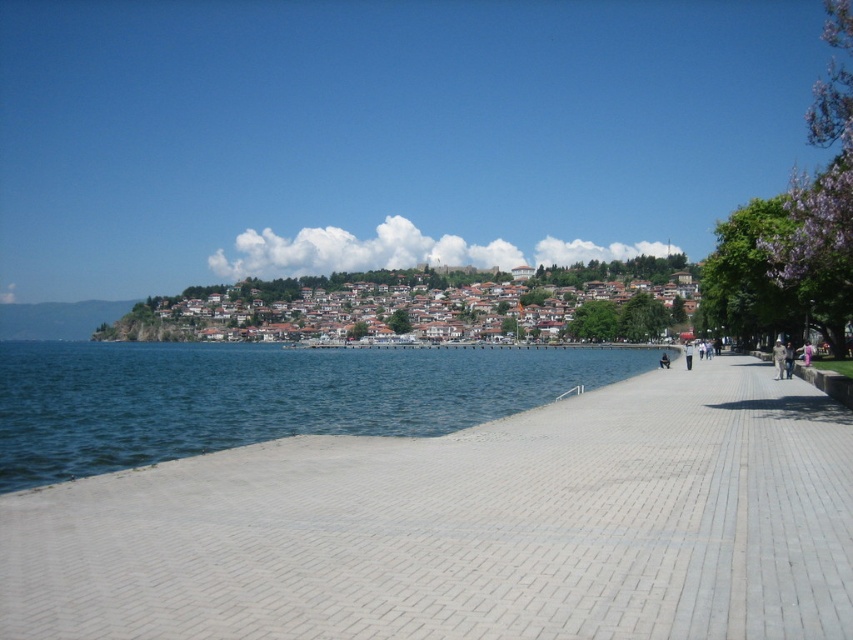
You are standing at the edge of the walkway in the waterfront scene. You notice a point marked at coordinates (x=469, y=528). What is located at that point?

The point at coordinates (x=469, y=528) indicates gray brick pavement at center.

You are standing on the gray brick pavement at center and want to reach the brown tiled houses at center. Which direction should you walk to get there?

You should walk towards the back since the gray brick pavement at center is in front of the brown tiled houses at center, meaning the houses are behind the pavement.

You are a city planner analyzing the waterfront area. Based on the scene, which area would be better for installing a new bench for visitors to enjoy the view? The gray brick pavement at center or the blue water at lower left?

The gray brick pavement at center would be better for installing a new bench since it is a solid surface, unlike the blue water at lower left which is a body of water and cannot support a bench.